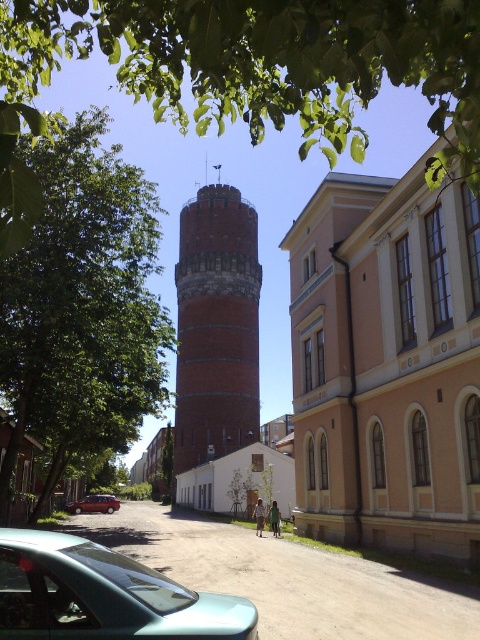
Does green leafy tree at upper center appear under teal glossy car at lower left?

Actually, green leafy tree at upper center is above teal glossy car at lower left.

Locate an element on the screen. Image resolution: width=480 pixels, height=640 pixels. green leafy tree at upper center is located at coordinates (264, 61).

Is point (276, 61) in front of point (98, 605)?

Yes, it is.

The width and height of the screenshot is (480, 640). Identify the location of green leafy tree at upper center. (264, 61).

Is green leafy tree at center taller than brick textured tower at center?

In fact, green leafy tree at center may be shorter than brick textured tower at center.

Between green leafy tree at center and brick textured tower at center, which one appears on the right side from the viewer's perspective?

Positioned to the right is brick textured tower at center.

Who is more forward, (60, 166) or (222, 404)?

Point (60, 166) is in front.

Find the location of a particular element. green leafy tree at center is located at coordinates (83, 305).

Between point (170, 35) and point (216, 186), which one is positioned behind?

Point (216, 186)

Can you confirm if green leafy tree at upper center is positioned to the right of brick textured tower at center?

Yes, green leafy tree at upper center is to the right of brick textured tower at center.

Between point (456, 86) and point (206, 305), which one is positioned behind?

Point (206, 305)

This screenshot has width=480, height=640. In order to click on green leafy tree at upper center in this screenshot , I will do (x=264, y=61).